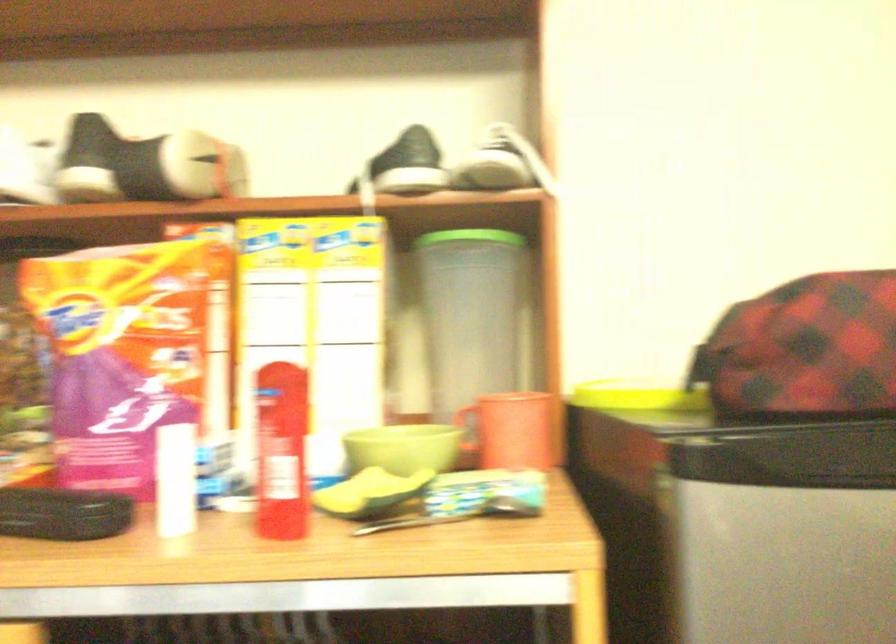
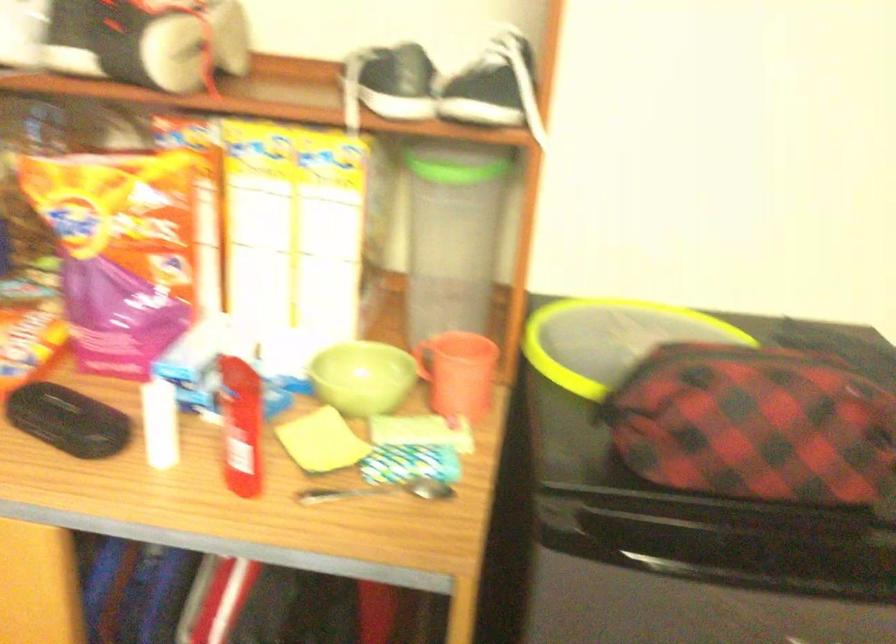
Question: The images are taken continuously from a first-person perspective. In which direction is your viewpoint rotating?

Choices:
 (A) Left
 (B) Right
 (C) Up
 (D) Down

Answer: (D)